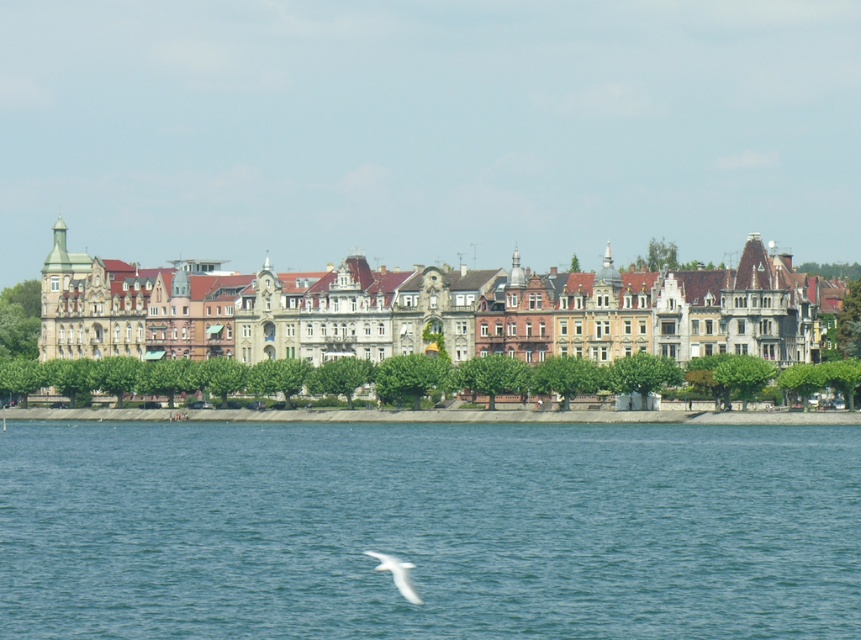
Between blue water at lower center and white feathered bird at lower center, which one appears on the right side from the viewer's perspective?

blue water at lower center is more to the right.

The width and height of the screenshot is (861, 640). Describe the element at coordinates (428, 529) in the screenshot. I see `blue water at lower center` at that location.

Which is behind, point (685, 428) or point (381, 566)?

The point (685, 428) is more distant.

Identify the location of blue water at lower center. Image resolution: width=861 pixels, height=640 pixels. (428, 529).